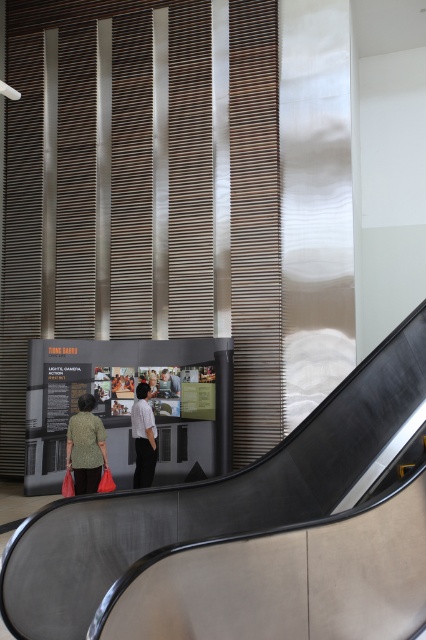
Question: Estimate the real-world distances between objects in this image. Which object is closer to the metallic gray escalator at lower center?

Choices:
 (A) white textured shirt at center
 (B) green textured sweater at center

Answer: (B)

Question: Does green textured sweater at center come behind white textured shirt at center?

Choices:
 (A) no
 (B) yes

Answer: (A)

Question: Considering the real-world distances, which object is farthest from the metallic gray escalator at lower center?

Choices:
 (A) white textured shirt at center
 (B) green textured sweater at center

Answer: (A)

Question: Is metallic gray escalator at lower center positioned at the back of green textured sweater at center?

Choices:
 (A) no
 (B) yes

Answer: (A)

Question: In this image, where is metallic gray escalator at lower center located relative to white textured shirt at center?

Choices:
 (A) right
 (B) left

Answer: (A)

Question: Which point is farther to the camera?

Choices:
 (A) (94, 483)
 (B) (57, 540)

Answer: (A)